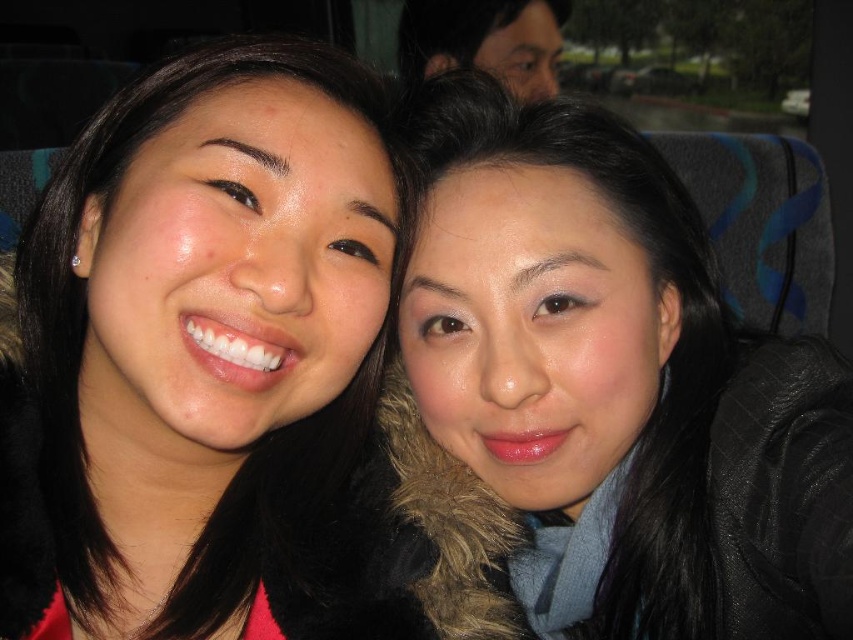
Question: Considering the relative positions of matte black jacket at center and matte black hair at upper center in the image provided, where is matte black jacket at center located with respect to matte black hair at upper center?

Choices:
 (A) right
 (B) left

Answer: (A)

Question: Which object appears closest to the camera in this image?

Choices:
 (A) matte black jacket at center
 (B) matte black hair at upper center
 (C) matte black hair at center

Answer: (C)

Question: Is matte black hair at center further to camera compared to matte black jacket at center?

Choices:
 (A) yes
 (B) no

Answer: (B)

Question: Which point is farther from the camera taking this photo?

Choices:
 (A) (473, 38)
 (B) (15, 609)
 (C) (544, 458)

Answer: (A)

Question: Can you confirm if matte black jacket at center is thinner than matte black hair at upper center?

Choices:
 (A) yes
 (B) no

Answer: (A)

Question: Which of the following is the farthest from the observer?

Choices:
 (A) coord(157,616)
 (B) coord(518,358)

Answer: (B)